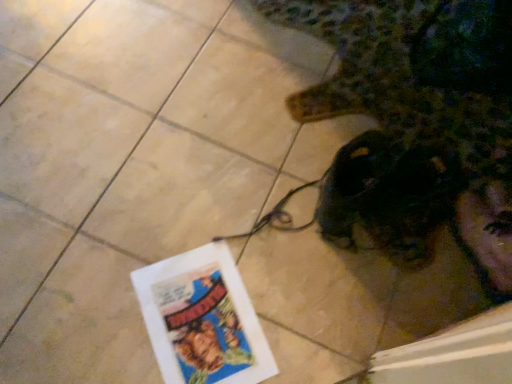
The image size is (512, 384). What are the coordinates of `vacant space behind white paper flyer at lower left` in the screenshot? It's located at (232, 225).